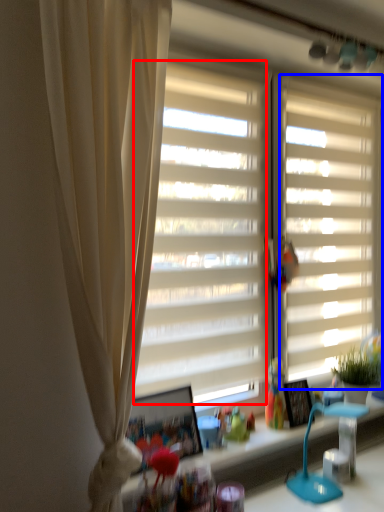
Question: Which of the following is the farthest to the observer, window screen (highlighted by a red box) or window blind (highlighted by a blue box)?

Choices:
 (A) window screen
 (B) window blind

Answer: (B)